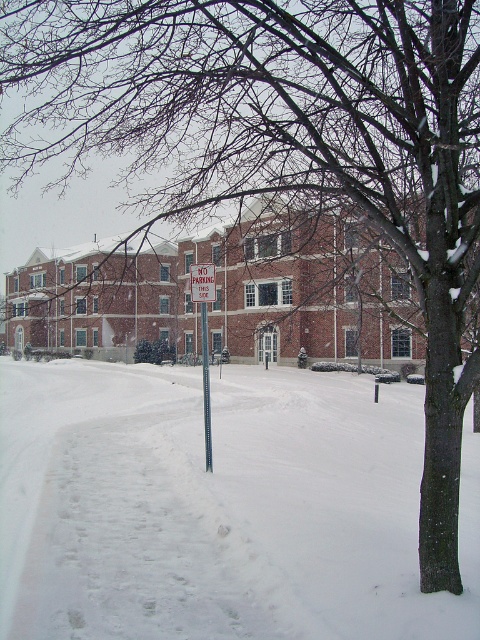
Question: Estimate the real-world distances between objects in this image. Which object is closer to the red plastic sign at center?

Choices:
 (A) white powdery snow at center
 (B) metallic rectangular sign at center

Answer: (B)

Question: Which object is farther from the camera taking this photo?

Choices:
 (A) red plastic sign at center
 (B) metallic rectangular sign at center
 (C) metallic pole at center
 (D) white powdery snow at center

Answer: (C)

Question: Estimate the real-world distances between objects in this image. Which object is closer to the metallic rectangular sign at center?

Choices:
 (A) white powdery snow at center
 (B) metallic pole at center
 (C) red plastic sign at center

Answer: (B)

Question: Is metallic rectangular sign at center smaller than red plastic sign at center?

Choices:
 (A) no
 (B) yes

Answer: (A)

Question: Does metallic pole at center appear on the right side of red plastic sign at center?

Choices:
 (A) yes
 (B) no

Answer: (B)

Question: Does white powdery snow at center appear on the left side of red plastic sign at center?

Choices:
 (A) yes
 (B) no

Answer: (B)